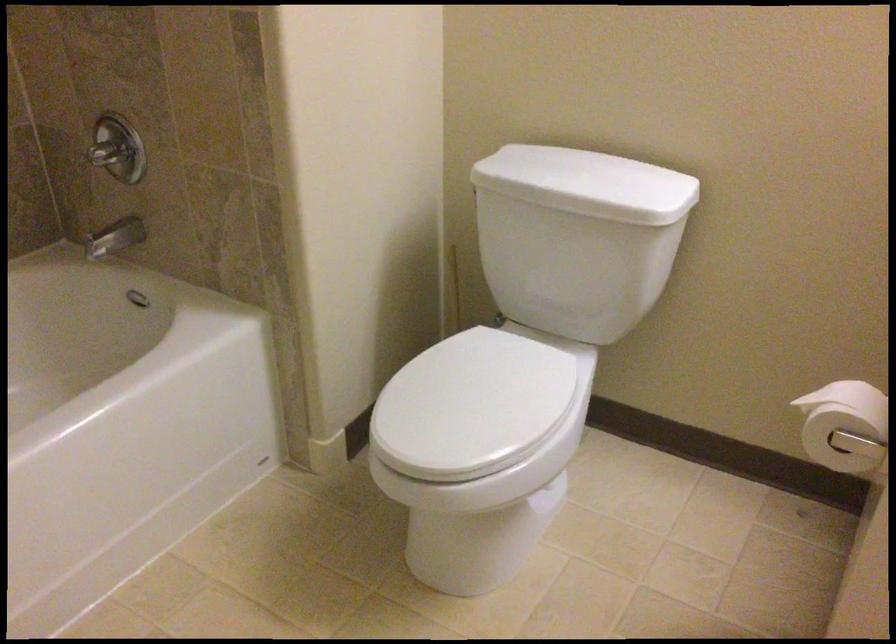
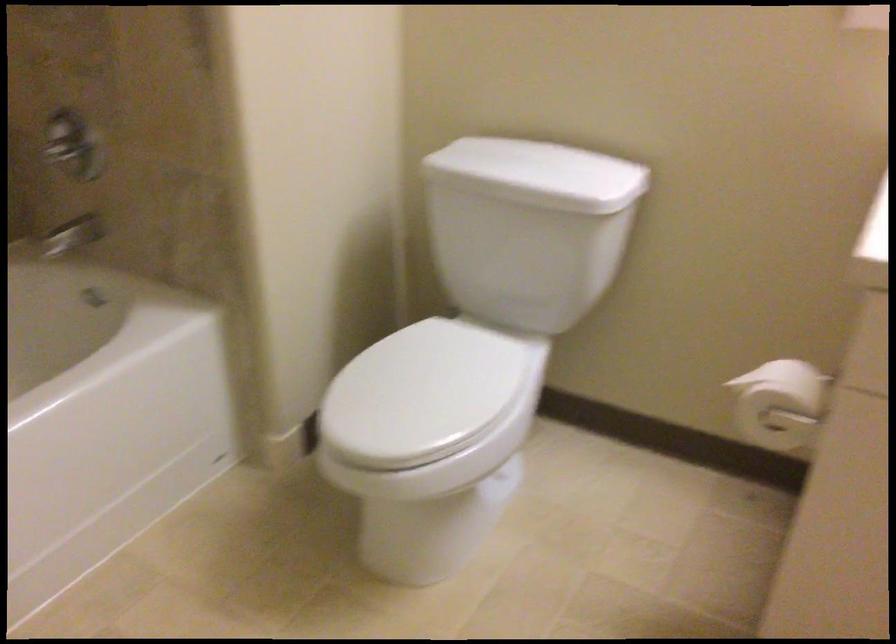
Question: How did the camera likely rotate?

Choices:
 (A) Left
 (B) Right
 (C) Up
 (D) Down

Answer: (B)